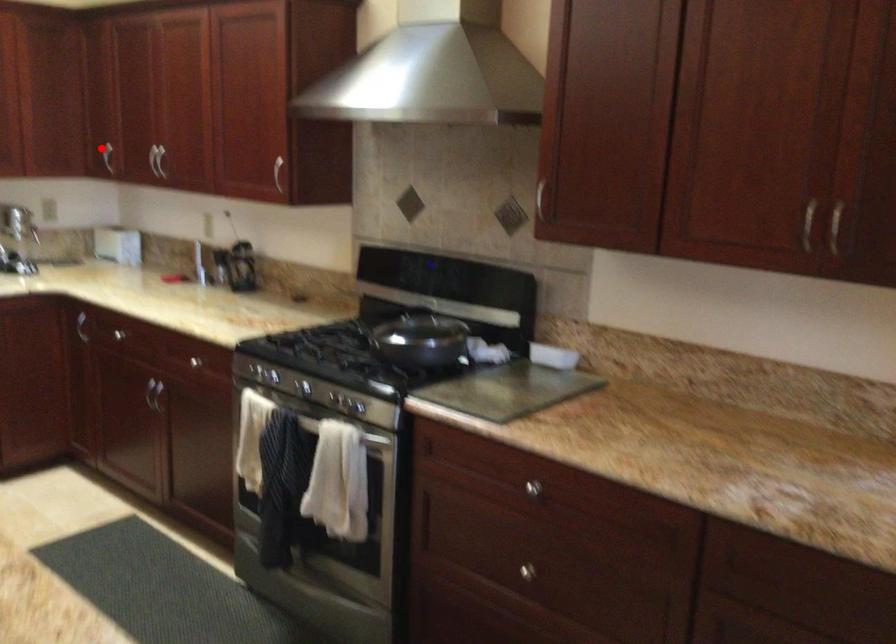
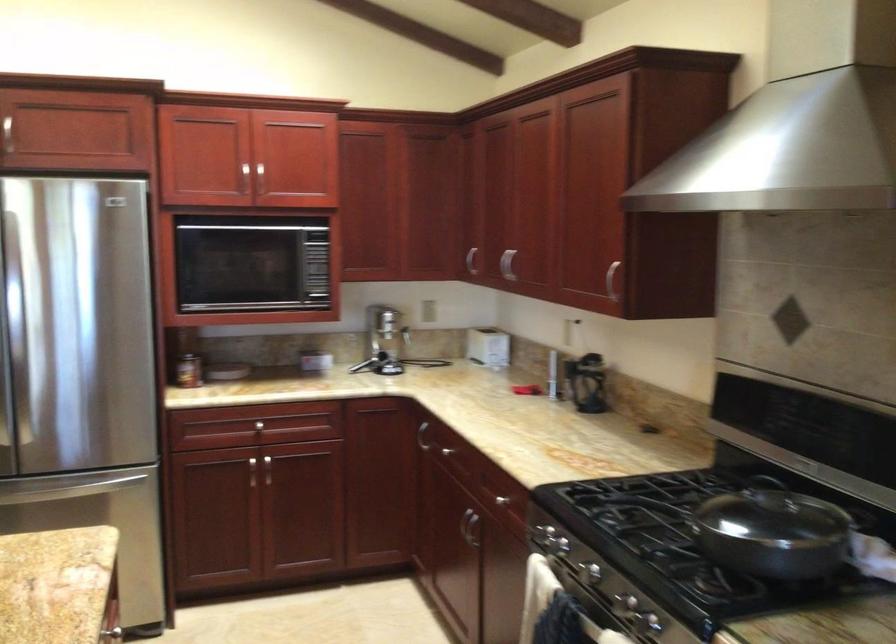
Locate, in the second image, the point that corresponds to the highlighted location in the first image.

(471, 261)